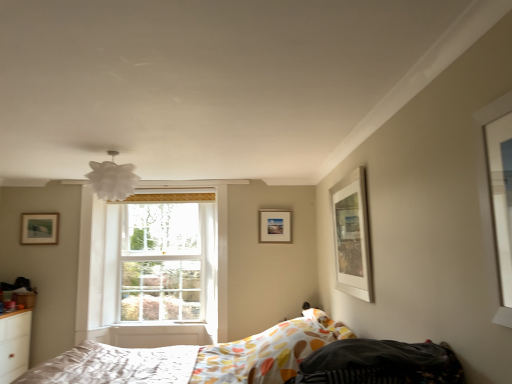
Question: Does wooden picture frame at upper left, which is the 3th picture frame in right-to-left order, have a smaller size compared to white matte picture frame at upper right, marked as the third picture frame in a left-to-right arrangement?

Choices:
 (A) yes
 (B) no

Answer: (A)

Question: Would you consider wooden picture frame at upper left, the 1th picture frame when ordered from left to right, to be distant from white matte picture frame at upper right, which is counted as the 1th picture frame, starting from the front?

Choices:
 (A) yes
 (B) no

Answer: (A)

Question: Is wooden picture frame at upper left, the 1th picture frame when ordered from left to right, beside white matte picture frame at upper right, which is counted as the 1th picture frame, starting from the front?

Choices:
 (A) yes
 (B) no

Answer: (B)

Question: Is wooden picture frame at upper left, the 1th picture frame when ordered from left to right, closer to camera compared to white matte picture frame at upper right, which appears as the 3th picture frame when viewed from the back?

Choices:
 (A) no
 (B) yes

Answer: (A)

Question: Is wooden picture frame at upper left, which is the 3th picture frame in right-to-left order, aimed at white matte picture frame at upper right, marked as the third picture frame in a left-to-right arrangement?

Choices:
 (A) no
 (B) yes

Answer: (A)

Question: In the image, is white matte picture frame at upper right, which appears as the 3th picture frame when viewed from the back, on the left side or the right side of wooden picture frame at upper left, arranged as the 2th picture frame when viewed from the front?

Choices:
 (A) right
 (B) left

Answer: (A)

Question: Would you say white matte picture frame at upper right, arranged as the 1th picture frame when viewed from the right, is inside or outside wooden picture frame at upper left, the 1th picture frame when ordered from left to right?

Choices:
 (A) outside
 (B) inside

Answer: (A)

Question: Looking at their shapes, would you say white matte picture frame at upper right, which appears as the 3th picture frame when viewed from the back, is wider or thinner than wooden picture frame at upper left, which is the 3th picture frame in right-to-left order?

Choices:
 (A) thin
 (B) wide

Answer: (B)

Question: Is point (349, 226) positioned closer to the camera than point (42, 235)?

Choices:
 (A) farther
 (B) closer

Answer: (B)

Question: Looking at the image, does white fabric mattress at lower left, placed as the second mattress when sorted from top to bottom, seem bigger or smaller compared to white matte picture frame at upper right, marked as the third picture frame in a left-to-right arrangement?

Choices:
 (A) small
 (B) big

Answer: (B)

Question: Which is correct: white fabric mattress at lower left, placed as the second mattress when sorted from top to bottom, is inside white matte picture frame at upper right, arranged as the 1th picture frame when viewed from the right, or outside of it?

Choices:
 (A) outside
 (B) inside

Answer: (A)

Question: From the image's perspective, is white fabric mattress at lower left, which ranks as the 1th mattress in left-to-right order, above or below white matte picture frame at upper right, arranged as the 1th picture frame when viewed from the right?

Choices:
 (A) below
 (B) above

Answer: (A)

Question: Would you say white fabric mattress at lower left, the second mattress viewed from the front, is to the left or to the right of white matte picture frame at upper right, marked as the third picture frame in a left-to-right arrangement, in the picture?

Choices:
 (A) left
 (B) right

Answer: (A)

Question: Is point (50, 367) closer or farther from the camera than point (327, 369)?

Choices:
 (A) closer
 (B) farther

Answer: (B)

Question: Relative to patterned fabric mattress at lower right, the second mattress positioned from the left, is white fabric mattress at lower left, arranged as the first mattress when ordered from the bottom, in front or behind?

Choices:
 (A) behind
 (B) front

Answer: (A)